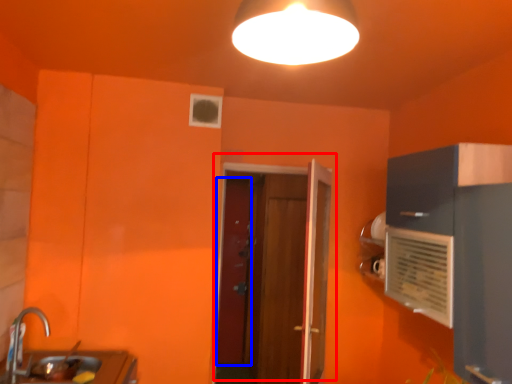
Question: Among these objects, which one is nearest to the camera, door (highlighted by a red box) or door (highlighted by a blue box)?

Choices:
 (A) door
 (B) door

Answer: (A)